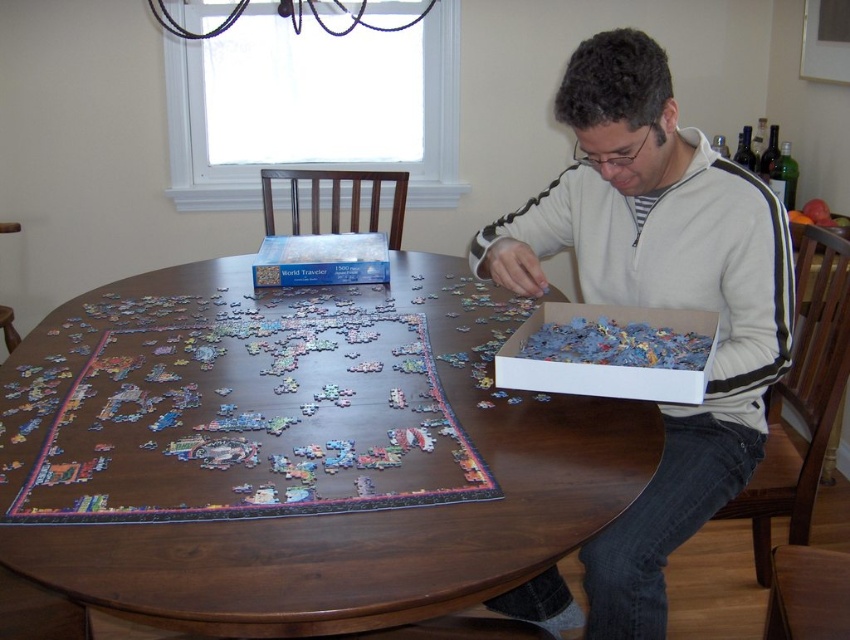
You are standing in the room and want to place a new puzzle piece on the dark wood round table at center. Where exactly should you aim to place it?

The dark wood round table at center is located at point (295, 451), so you should aim for that coordinate to place the puzzle piece there.

You are a puzzle enthusiast trying to place a new piece at point [658,298]. Is there already an object at that location?

Yes, the white fleece sweater at center is located at point [658,298].